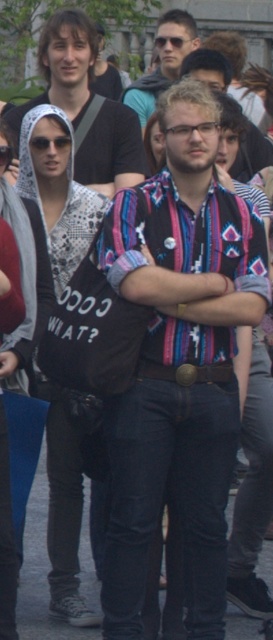
Is patterned fabric shirt at center wider than matte black shirt at upper left?

No.

Is point (117, 289) behind point (81, 54)?

No.

This screenshot has height=640, width=273. In order to click on patterned fabric shirt at center in this screenshot , I will do `click(179, 364)`.

Is point (43, 51) closer to camera compared to point (164, 132)?

No.

You are a GUI agent. You are given a task and a screenshot of the screen. Output one action in this format:
    pyautogui.click(x=<x>, y=<y>)
    Task: Click on the matte black shirt at upper left
    The width and height of the screenshot is (273, 640).
    Given the screenshot: What is the action you would take?
    pyautogui.click(x=63, y=67)

This screenshot has height=640, width=273. What do you see at coordinates (63, 67) in the screenshot? I see `matte black shirt at upper left` at bounding box center [63, 67].

I want to click on matte black shirt at upper left, so click(63, 67).

Is matte black shirt at center wider than black plastic goggles at upper center?

Yes, matte black shirt at center is wider than black plastic goggles at upper center.

From the picture: Who is more distant from viewer, (x=179, y=19) or (x=1, y=160)?

The point (x=179, y=19) is behind.

I want to click on matte black shirt at center, so pos(162,61).